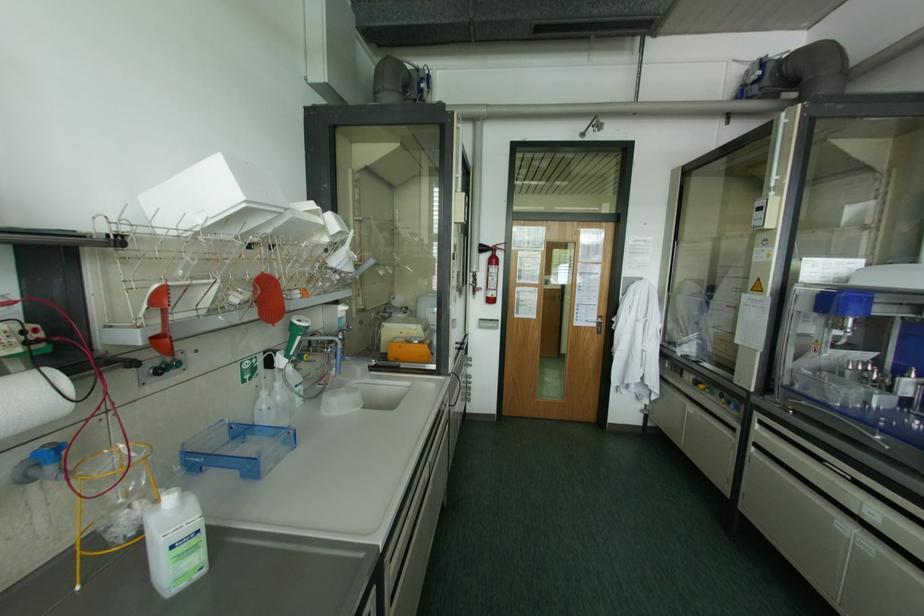
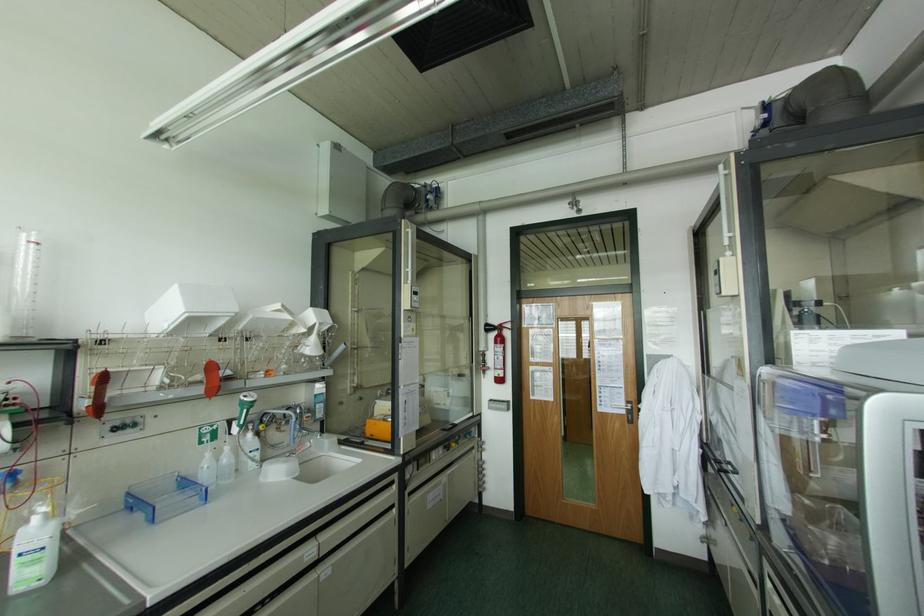
The point at (276,383) is marked in the first image. Where is the corresponding point in the second image?

(226, 448)